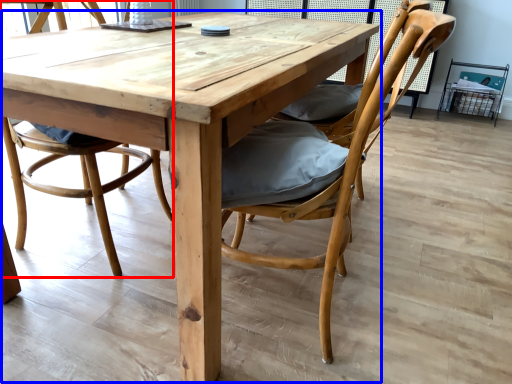
Question: Which object is further to the camera taking this photo, chair (highlighted by a red box) or kitchen & dining room table (highlighted by a blue box)?

Choices:
 (A) chair
 (B) kitchen & dining room table

Answer: (A)